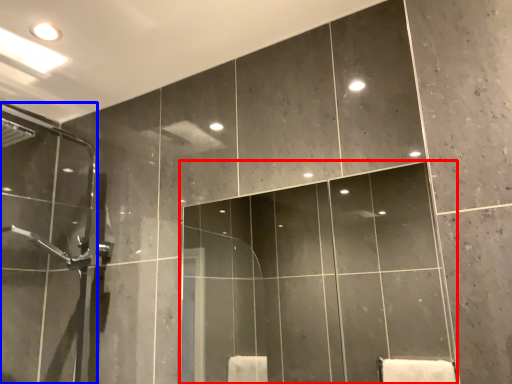
Question: Which of the following is the closest to the observer, mirror (highlighted by a red box) or screen door (highlighted by a blue box)?

Choices:
 (A) mirror
 (B) screen door

Answer: (A)